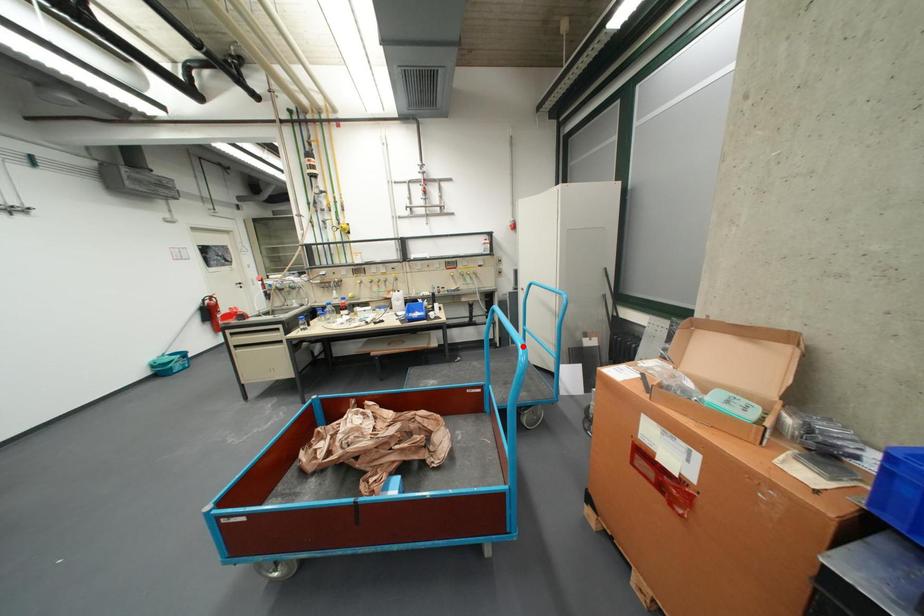
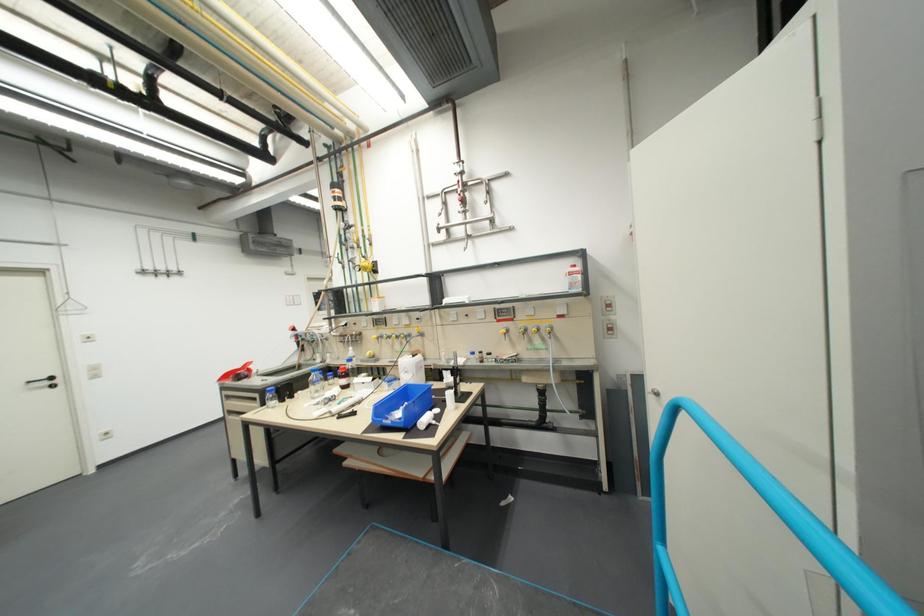
In the second image, find the point that corresponds to the highlighted location in the first image.

(652, 498)